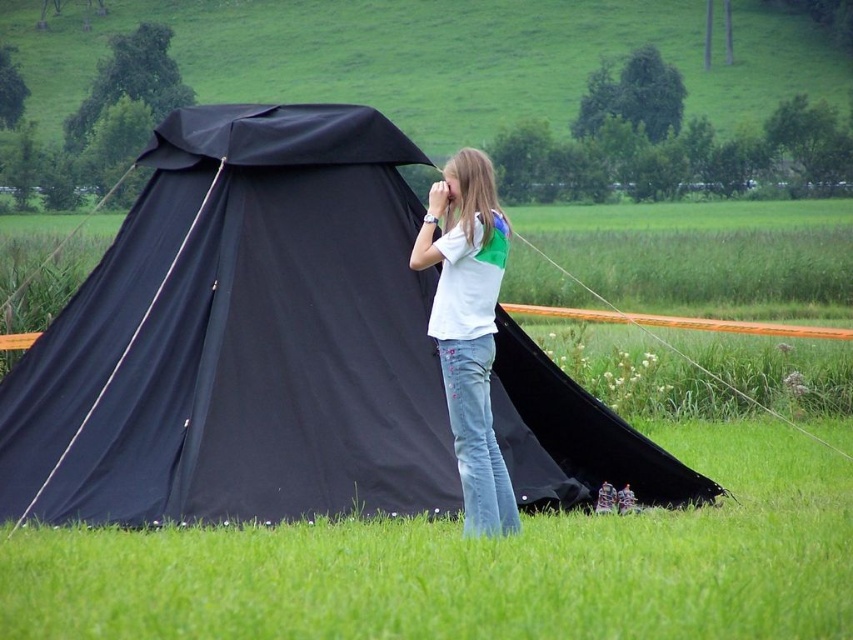
You are a photographer trying to capture the black fabric tent at center and the white cotton shirt at center in a single frame. Based on their positions, can you tell which object will appear larger in the photo?

The black fabric tent at center is above the white cotton shirt at center, so it will appear larger in the photo because objects higher up in the frame tend to dominate and appear bigger when captured from a lower angle.

You are standing in front of the black tent on the grassy field. You notice two points marked in the image. Which point, point (160, 472) or point (445, 321), is closer to you?

Point (160, 472) is closer to you because it is further to the viewer than point (445, 321).